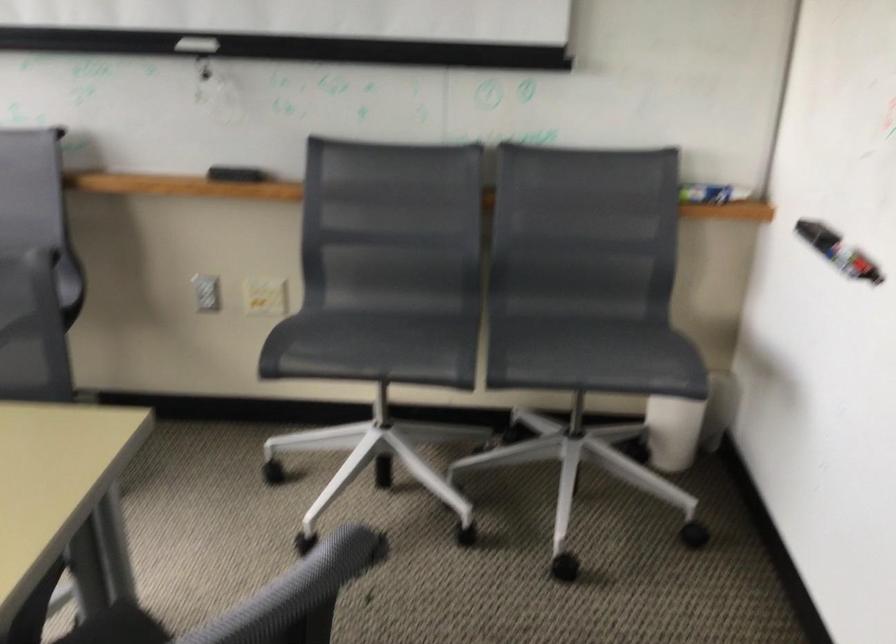
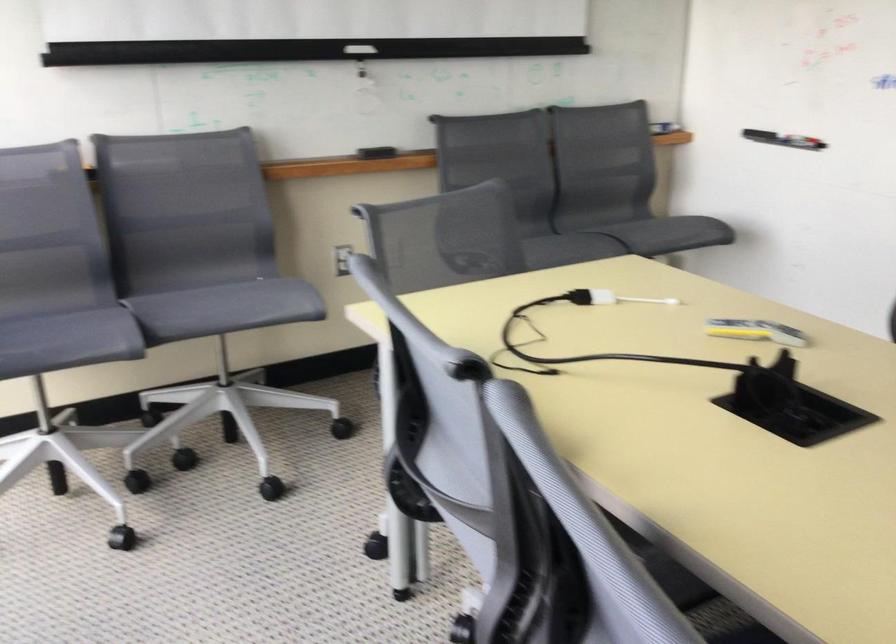
Question: What movement of the cameraman would produce the second image?

Choices:
 (A) Left
 (B) Right
 (C) Forward
 (D) Backward

Answer: (A)